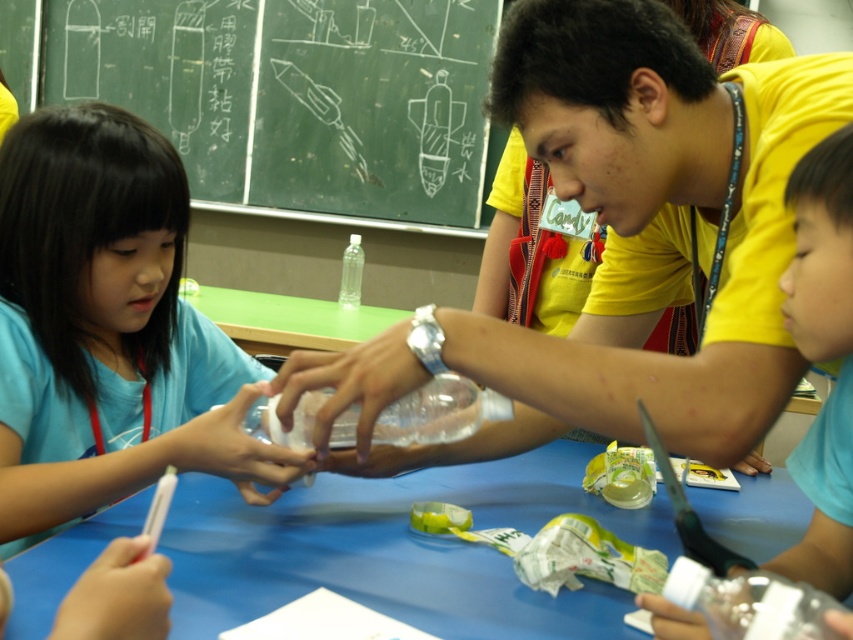
Who is positioned more to the left, matte blue shirt at left or translucent plastic bottle at right?

Positioned to the left is matte blue shirt at left.

Who is more forward, (62, 518) or (676, 636)?

Point (676, 636) is more forward.

In order to click on matte blue shirt at left in this screenshot , I will do `click(102, 324)`.

Who is lower down, white chalkboard at upper left or transparent plastic bottle at lower right?

Positioned lower is transparent plastic bottle at lower right.

Which is behind, point (47, 88) or point (692, 579)?

The point (47, 88) is behind.

Between point (408, 161) and point (691, 579), which one is positioned in front?

Point (691, 579) is in front.

Where is `white chalkboard at upper left`? Image resolution: width=853 pixels, height=640 pixels. white chalkboard at upper left is located at coordinates (296, 96).

Can you confirm if translucent plastic bottle at right is taller than transparent plastic bottle at center?

Yes.

Is translucent plastic bottle at right positioned before transparent plastic bottle at center?

That is True.

Where is `translucent plastic bottle at right`? The width and height of the screenshot is (853, 640). translucent plastic bottle at right is located at coordinates (822, 358).

Find the location of a particular element. The width and height of the screenshot is (853, 640). translucent plastic bottle at right is located at coordinates (822, 358).